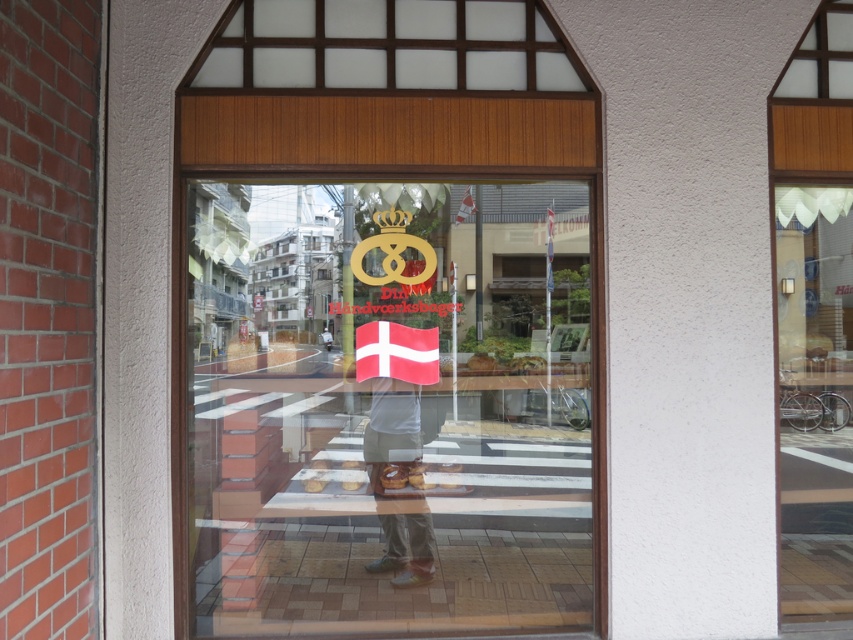
Between transparent glass door at center and clear glass door at right, which one is positioned lower?

clear glass door at right is lower down.

You are a GUI agent. You are given a task and a screenshot of the screen. Output one action in this format:
    pyautogui.click(x=<x>, y=<y>)
    Task: Click on the transparent glass door at center
    This screenshot has height=640, width=853.
    Given the screenshot: What is the action you would take?
    pyautogui.click(x=387, y=406)

Image resolution: width=853 pixels, height=640 pixels. Identify the location of transparent glass door at center. (387, 406).

Is clear glass door at right below denim pants at center?

Incorrect, clear glass door at right is not positioned below denim pants at center.

Is point (798, 236) positioned before point (427, 424)?

No, it is not.

Describe the element at coordinates (814, 400) in the screenshot. I see `clear glass door at right` at that location.

The width and height of the screenshot is (853, 640). I want to click on clear glass door at right, so click(x=814, y=400).

Is point (386, 616) positioned before point (419, 442)?

Yes, point (386, 616) is closer to viewer.

Is point (540, 595) positioned after point (427, 512)?

No, (540, 595) is in front of (427, 512).

Where is `transparent glass door at center`? transparent glass door at center is located at coordinates (387, 406).